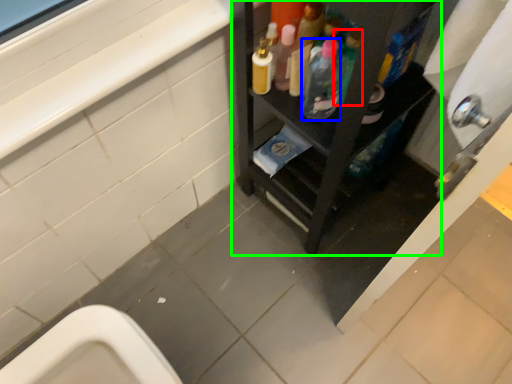
Question: Estimate the real-world distances between objects in this image. Which object is closer to bottle (highlighted by a red box), bottle (highlighted by a blue box) or furniture (highlighted by a green box)?

Choices:
 (A) bottle
 (B) furniture

Answer: (A)